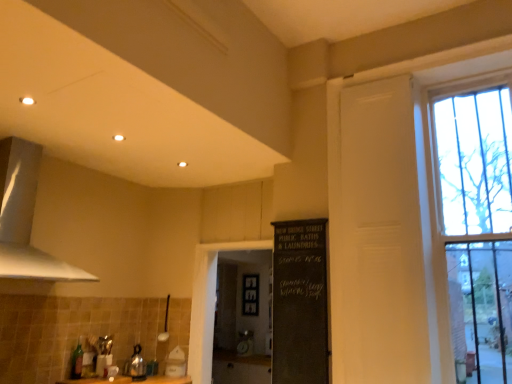
Identify the location of vacant area on top of white painted wood window at upper right (from a real-world perspective). (414, 57).